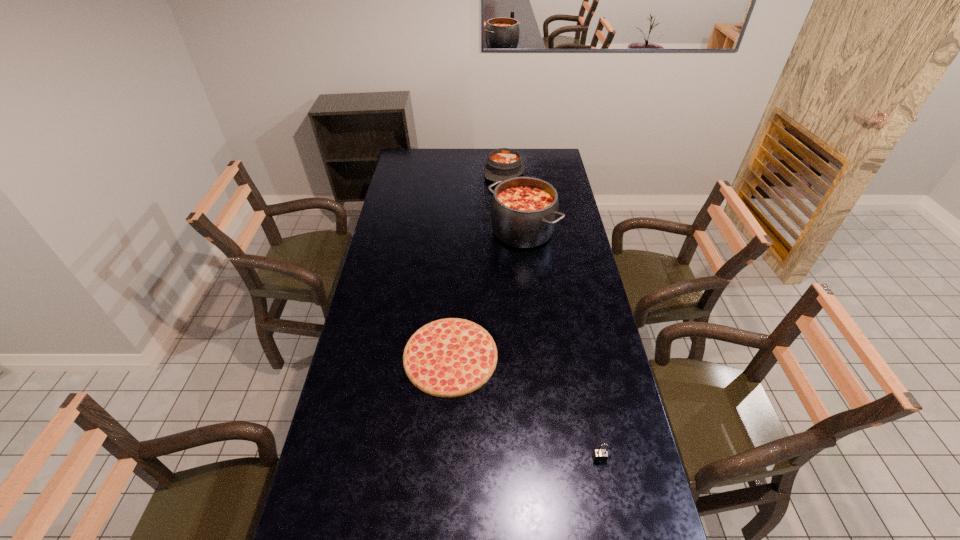
I want to click on the taller casserole, so click(x=524, y=210).

This screenshot has height=540, width=960. I want to click on the third nearest object, so click(524, 210).

At what (x,y) coordinates should I click in order to perform the action: click on the farthest object. Please return your answer as a coordinate pair (x, y). The height and width of the screenshot is (540, 960). Looking at the image, I should click on (504, 163).

This screenshot has height=540, width=960. I want to click on the shorter casserole, so click(x=504, y=163).

At what (x,y) coordinates should I click in order to perform the action: click on the nearest object. Please return your answer as a coordinate pair (x, y). Looking at the image, I should click on (600, 455).

Locate an element on the screen. the third farthest object is located at coordinates (451, 357).

You are a GUI agent. You are given a task and a screenshot of the screen. Output one action in this format:
    pyautogui.click(x=<x>, y=<y>)
    Task: Click on the shortest object
    This screenshot has width=960, height=540.
    Given the screenshot: What is the action you would take?
    pyautogui.click(x=451, y=357)

What are the coordinates of `vacant area located 0.250m on the left of the taller casserole` in the screenshot? It's located at (433, 231).

Find the location of a particular element. vacant space situated 0.400m on the left of the farther casserole is located at coordinates (410, 172).

Where is `blank space located 0.150m on the shackle of the padlock`? The height and width of the screenshot is (540, 960). blank space located 0.150m on the shackle of the padlock is located at coordinates (612, 521).